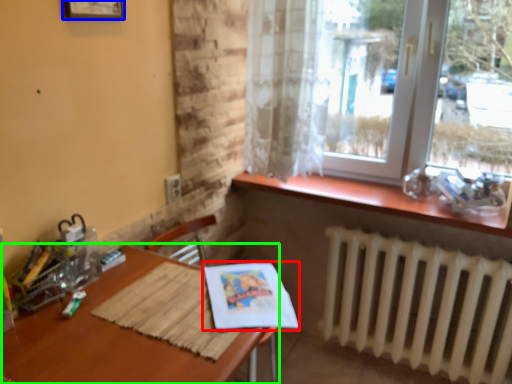
Question: Which object is positioned farthest from magazine (highlighted by a red box)? Select from picture frame (highlighted by a blue box) and table (highlighted by a green box).

Choices:
 (A) picture frame
 (B) table

Answer: (A)